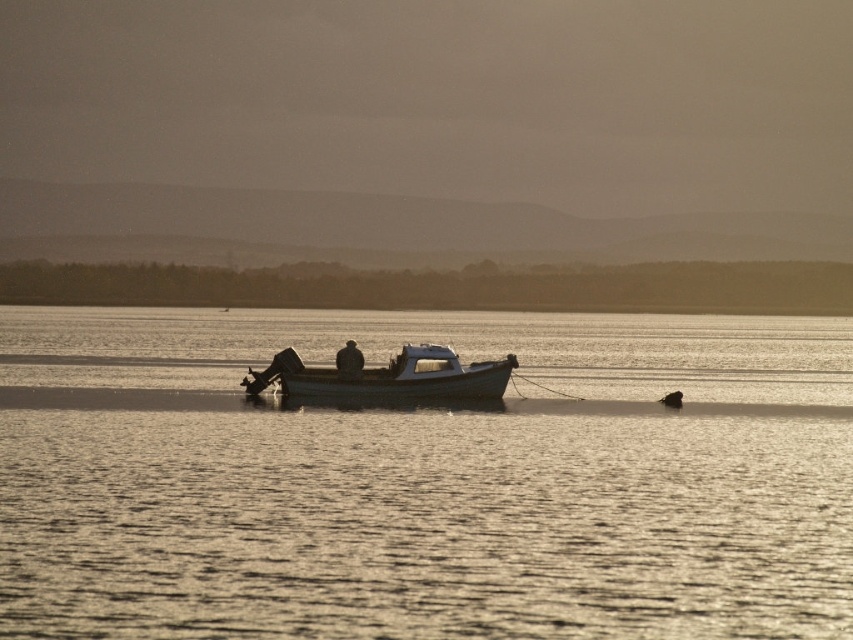
Does white matte boat at center appear on the right side of dark textured jacket at center?

Correct, you'll find white matte boat at center to the right of dark textured jacket at center.

Between point (498, 372) and point (358, 368), which one is positioned behind?

The point (498, 372) is more distant.

Does point (412, 362) come closer to viewer compared to point (351, 372)?

No, (412, 362) is behind (351, 372).

This screenshot has height=640, width=853. What are the coordinates of `white matte boat at center` in the screenshot? It's located at (386, 378).

Which is below, silvery reflective water at center or white matte boat at center?

white matte boat at center is lower down.

Can you confirm if silvery reflective water at center is taller than white matte boat at center?

Correct, silvery reflective water at center is much taller as white matte boat at center.

Is point (347, 483) positioned behind point (338, 358)?

No, (347, 483) is closer to viewer.

Locate an element on the screen. silvery reflective water at center is located at coordinates (424, 481).

Who is taller, silvery reflective water at center or dark textured jacket at center?

With more height is silvery reflective water at center.

Where is `silvery reflective water at center`? silvery reflective water at center is located at coordinates (424, 481).